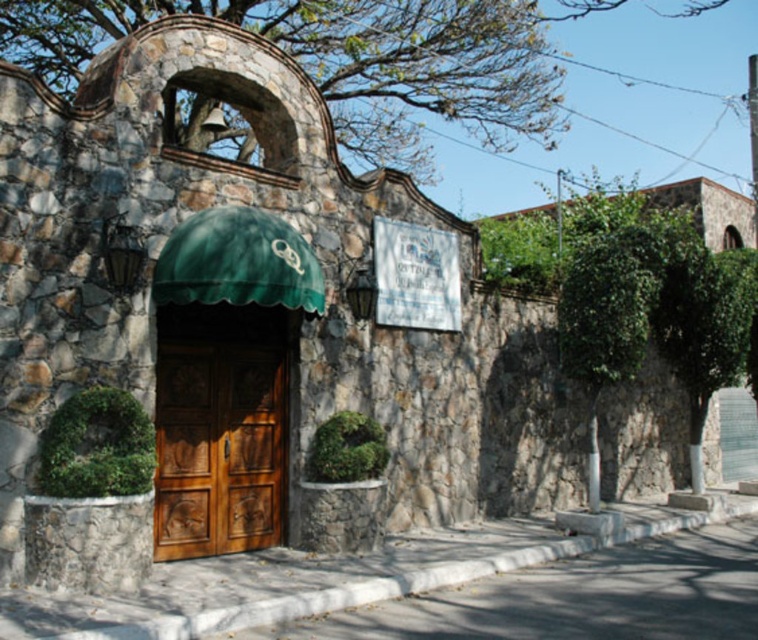
You are standing in front of the stone structure and notice the green leafy tree at upper center and the wooden door at center. Which object appears larger in the image?

The green leafy tree at upper center appears larger than the wooden door at center because it is much taller as stated in the description.